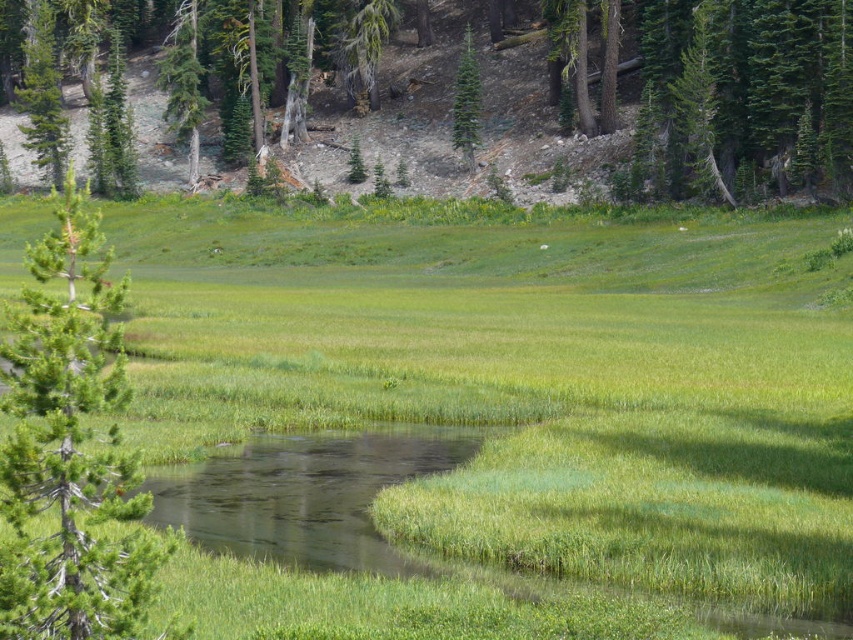
You are standing at the point with coordinates point (70,449) in the image. What object is located at that point?

The point (70,449) corresponds to the green textured pine tree at left.